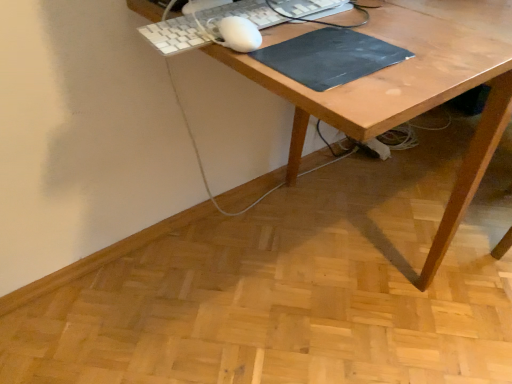
You are a GUI agent. You are given a task and a screenshot of the screen. Output one action in this format:
    pyautogui.click(x=<x>, y=<y>)
    Task: Click on the vacant space to the right of black matte mousepad at center
    This screenshot has width=512, height=384.
    Given the screenshot: What is the action you would take?
    pyautogui.click(x=434, y=46)